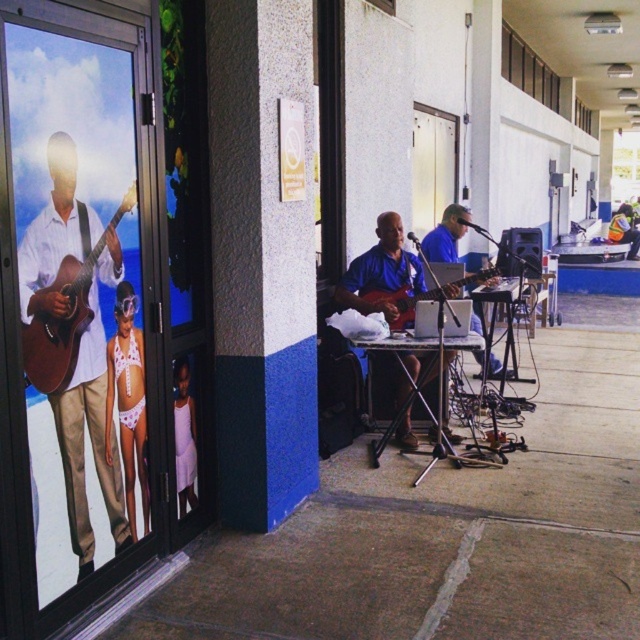
Question: Does brown acoustic guitar at left have a larger size compared to white matte dress at lower left?

Choices:
 (A) yes
 (B) no

Answer: (A)

Question: Among these points, which one is farthest from the camera?

Choices:
 (A) (349, 301)
 (B) (388, 324)
 (C) (611, 218)

Answer: (C)

Question: Is white lace bikini at left smaller than brown acoustic guitar at left?

Choices:
 (A) no
 (B) yes

Answer: (B)

Question: Which point is farther from the camera taking this photo?

Choices:
 (A) (61, 291)
 (B) (124, 365)
 (C) (356, 260)

Answer: (C)

Question: Is white lace bikini at left smaller than blue fabric shirt at center?

Choices:
 (A) no
 (B) yes

Answer: (B)

Question: Which point appears closest to the camera in this image?

Choices:
 (A) (113, 224)
 (B) (141, 458)
 (C) (104, 468)
 (D) (188, 496)

Answer: (A)